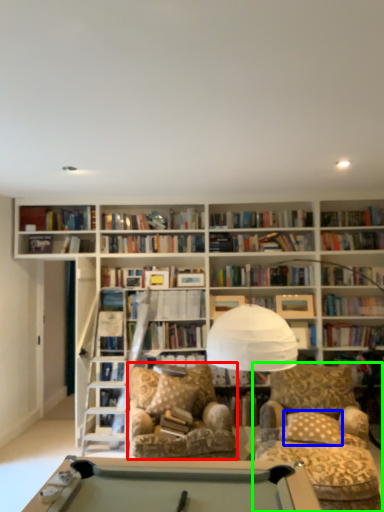
Question: Which object is the closest to the swivel chair (highlighted by a red box)? Choose among these: pillow (highlighted by a blue box) or chair (highlighted by a green box).

Choices:
 (A) pillow
 (B) chair

Answer: (B)